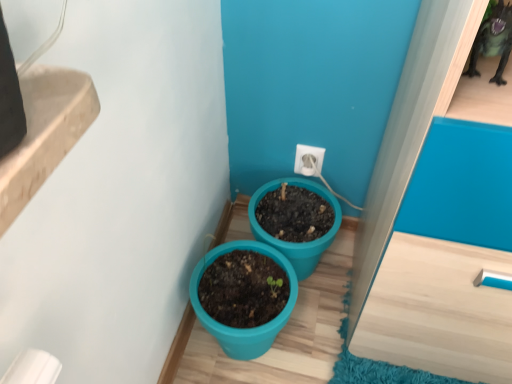
Question: Is teal plastic pot at center, the 1th flowerpot in the left-to-right sequence, positioned behind white plastic electric outlet at center?

Choices:
 (A) yes
 (B) no

Answer: (B)

Question: Is teal plastic pot at center, the 1th flowerpot in the left-to-right sequence, wider than white plastic electric outlet at center?

Choices:
 (A) yes
 (B) no

Answer: (A)

Question: From the image's perspective, does teal plastic pot at center, the 1th flowerpot in the left-to-right sequence, appear lower than white plastic electric outlet at center?

Choices:
 (A) no
 (B) yes

Answer: (B)

Question: Is teal plastic pot at center, the 1th flowerpot in the left-to-right sequence, positioned beyond the bounds of white plastic electric outlet at center?

Choices:
 (A) yes
 (B) no

Answer: (A)

Question: From a real-world perspective, is teal plastic pot at center, which appears as the 2th flowerpot when viewed from the right, positioned over white plastic electric outlet at center based on gravity?

Choices:
 (A) yes
 (B) no

Answer: (B)

Question: Is teal plastic pot at center, which appears as the 2th flowerpot when viewed from the right, inside or outside of teal plastic pot at lower center, the first flowerpot when ordered from right to left?

Choices:
 (A) inside
 (B) outside

Answer: (B)

Question: Would you say teal plastic pot at center, the 1th flowerpot in the left-to-right sequence, is to the left or to the right of teal plastic pot at lower center, which is the second flowerpot in left-to-right order, in the picture?

Choices:
 (A) left
 (B) right

Answer: (A)

Question: From a real-world perspective, is teal plastic pot at center, the 1th flowerpot in the left-to-right sequence, above or below teal plastic pot at lower center, the first flowerpot when ordered from right to left?

Choices:
 (A) above
 (B) below

Answer: (A)

Question: Considering the positions of teal plastic pot at center, the 1th flowerpot in the left-to-right sequence, and teal plastic pot at lower center, the first flowerpot when ordered from right to left, in the image, is teal plastic pot at center, the 1th flowerpot in the left-to-right sequence, bigger or smaller than teal plastic pot at lower center, the first flowerpot when ordered from right to left,?

Choices:
 (A) big
 (B) small

Answer: (A)

Question: Is teal plastic pot at center, the 1th flowerpot in the left-to-right sequence, wider or thinner than white plastic electric outlet at center?

Choices:
 (A) thin
 (B) wide

Answer: (B)

Question: Relative to white plastic electric outlet at center, is teal plastic pot at center, which appears as the 2th flowerpot when viewed from the right, in front or behind?

Choices:
 (A) front
 (B) behind

Answer: (A)

Question: From a real-world perspective, relative to white plastic electric outlet at center, is teal plastic pot at center, the 1th flowerpot in the left-to-right sequence, vertically above or below?

Choices:
 (A) below
 (B) above

Answer: (A)

Question: From the image's perspective, relative to white plastic electric outlet at center, is teal plastic pot at center, the 1th flowerpot in the left-to-right sequence, above or below?

Choices:
 (A) above
 (B) below

Answer: (B)

Question: Considering the positions of white plastic electric outlet at center and teal plastic pot at lower center, the first flowerpot when ordered from right to left, in the image, is white plastic electric outlet at center taller or shorter than teal plastic pot at lower center, the first flowerpot when ordered from right to left,?

Choices:
 (A) short
 (B) tall

Answer: (A)

Question: Based on their sizes in the image, would you say white plastic electric outlet at center is bigger or smaller than teal plastic pot at lower center, the first flowerpot when ordered from right to left?

Choices:
 (A) big
 (B) small

Answer: (B)